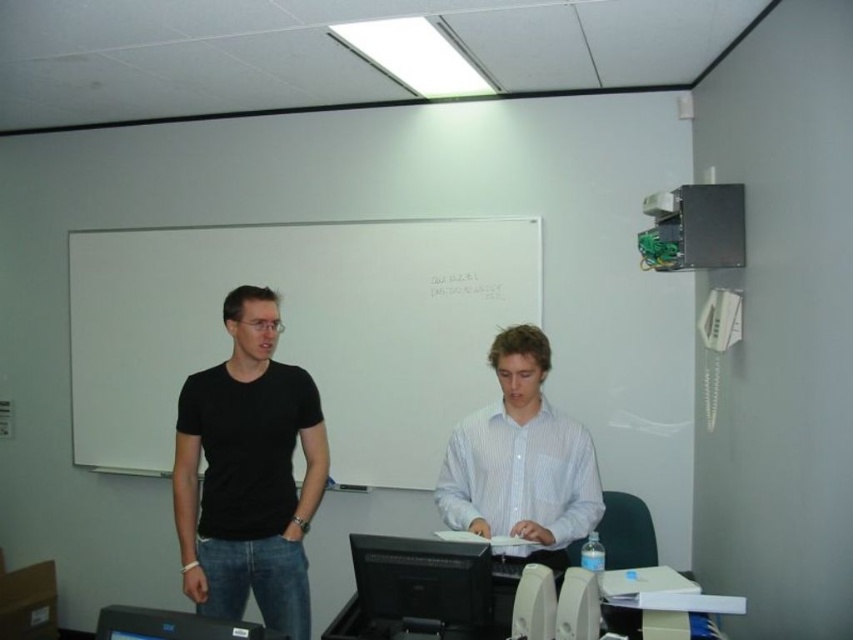
You are a student who needs to print a document. You are standing at the entrance of the classroom, which is on the opposite side of the white plastic printer at lower center. The black glossy monitor at center is between you and the printer. Can you reach the printer without moving the monitor?

The black glossy monitor at center is 15.33 inches away from the white plastic printer at lower center. Since the monitor is between you and the printer, you would need to move it to access the printer, but the distance suggests it might be possible to navigate around it if there is enough space. However, the question specifies not moving the monitor, so you cannot reach the printer without moving the monitor.

You are setting up a desk in the classroom and need to place both the black glossy monitor at center and the white plastic printer at lower center. Since the desk has limited space, which object should you place first to ensure both fit properly?

The black glossy monitor at center should be placed first because it has a smaller size compared to the white plastic printer at lower center, allowing more space for the larger printer afterward.

Looking at this image, you are a technician who needs to adjust the distance between the black glossy monitor at center and the camera to 5 feet for optimal video conferencing. Currently, they are 6.30 feet apart. How much distance should you move the monitor closer to the camera?

The black glossy monitor at center and camera are currently 6.30 feet apart. To achieve the desired 5 feet distance, you need to reduce the gap by 1.30 feet. Move the monitor closer to the camera by 1.30 feet.